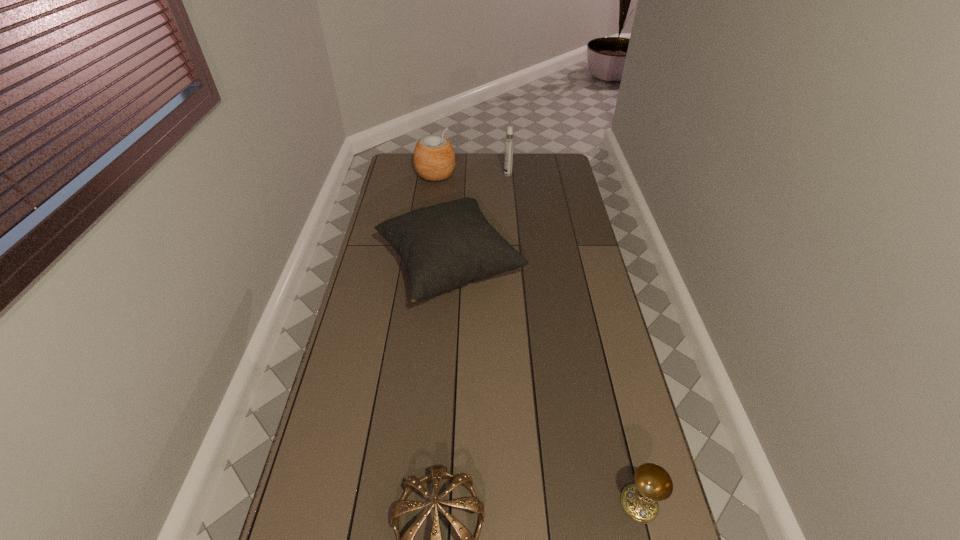
This screenshot has height=540, width=960. Find the location of `coconut at the left edge`. coconut at the left edge is located at coordinates click(x=434, y=159).

Where is `cushion that is at the left edge`? The height and width of the screenshot is (540, 960). cushion that is at the left edge is located at coordinates (447, 245).

Find the location of a particular element. This screenshot has height=540, width=960. object that is at the right edge is located at coordinates (653, 483).

This screenshot has height=540, width=960. What are the coordinates of `object that is at the far left corner` in the screenshot? It's located at (434, 159).

What are the coordinates of `free space at the far edge` in the screenshot? It's located at (479, 166).

I want to click on vacant space at the left edge of the desktop, so click(407, 200).

This screenshot has width=960, height=540. Identify the location of vacant space at the right edge of the desktop. (604, 462).

You are a GUI agent. You are given a task and a screenshot of the screen. Output one action in this format:
    pyautogui.click(x=<x>, y=<y>)
    Task: Click on the vacant space in between the chalice and the coconut
    
    Given the screenshot: What is the action you would take?
    pyautogui.click(x=538, y=339)

Identify the location of free space between the rightmost object and the aerosol can. (573, 339).

Find the location of `vacant area that lies between the aerosol can and the coconut`. vacant area that lies between the aerosol can and the coconut is located at coordinates (471, 174).